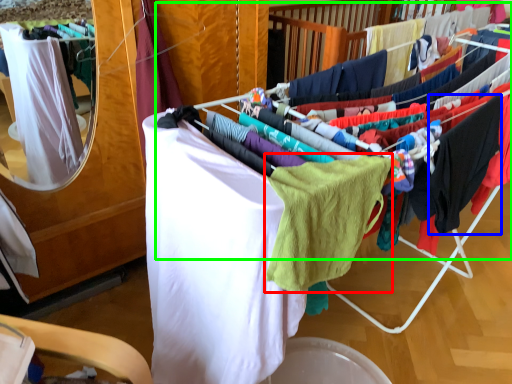
Question: Estimate the real-world distances between objects in this image. Which object is farther from baby clothe (highlighted by a red box), clothing (highlighted by a blue box) or closet (highlighted by a green box)?

Choices:
 (A) clothing
 (B) closet

Answer: (B)